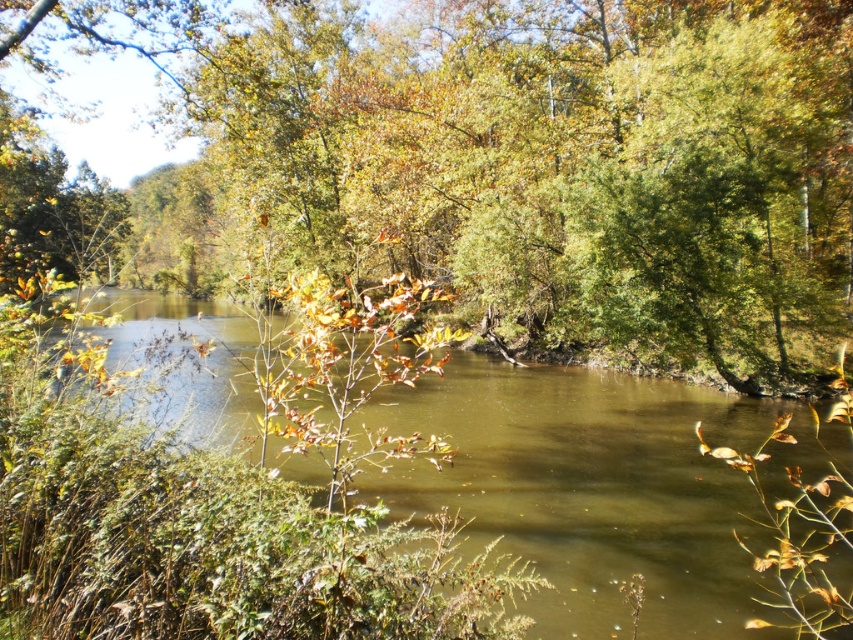
Is green leafy tree at center bigger than brown murky water at center?

Indeed, green leafy tree at center has a larger size compared to brown murky water at center.

Which is above, green leafy tree at center or brown murky water at center?

green leafy tree at center is higher up.

Find the location of `green leafy tree at center`. green leafy tree at center is located at coordinates (486, 170).